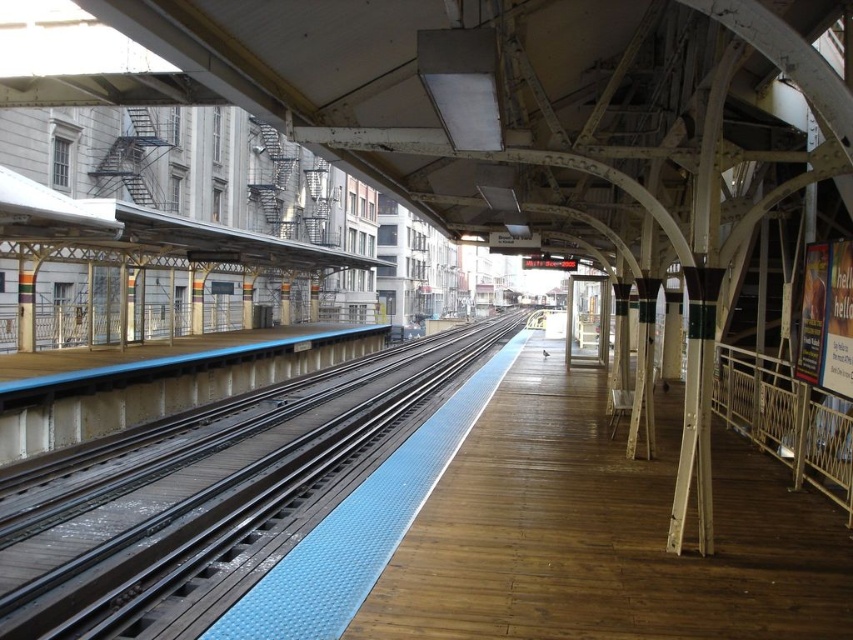
Question: Is wooden platform at center thinner than blue rubber train track at center?

Choices:
 (A) no
 (B) yes

Answer: (B)

Question: Which point is farther to the camera?

Choices:
 (A) (432, 612)
 (B) (276, 458)

Answer: (B)

Question: Which of the following is the closest to the observer?

Choices:
 (A) wooden platform at center
 (B) blue rubber train track at center

Answer: (A)

Question: From the image, what is the correct spatial relationship of wooden platform at center in relation to blue rubber train track at center?

Choices:
 (A) below
 (B) above

Answer: (B)

Question: Observing the image, what is the correct spatial positioning of wooden platform at center in reference to blue rubber train track at center?

Choices:
 (A) left
 (B) right

Answer: (B)

Question: Which object is farther from the camera taking this photo?

Choices:
 (A) wooden platform at center
 (B) blue rubber train track at center

Answer: (B)